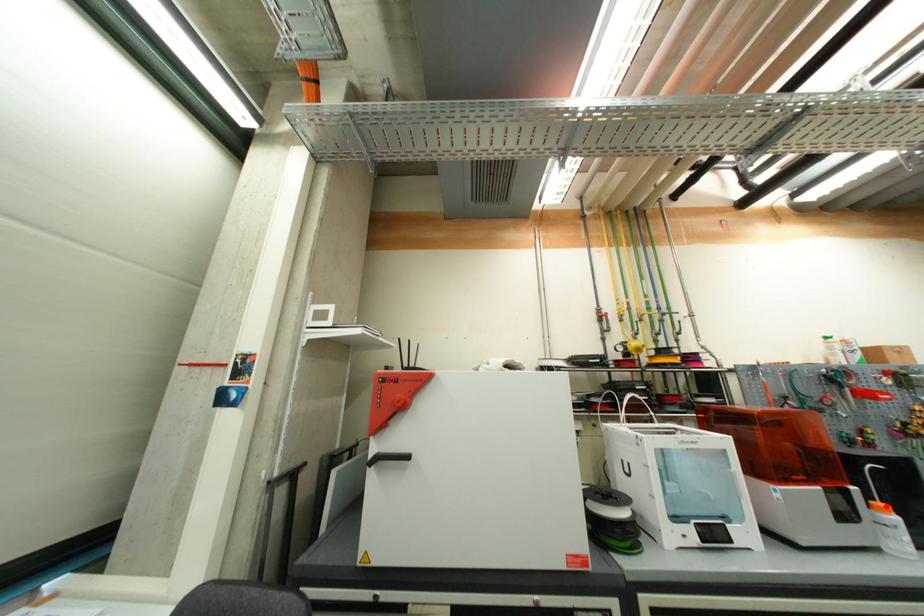
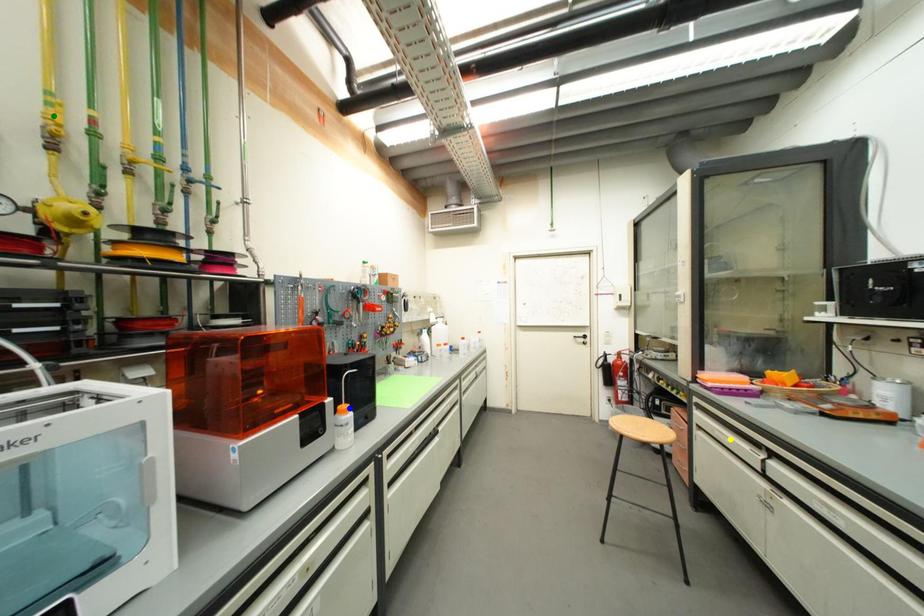
Question: I am providing you with two images of the same scene from different viewpoints. A red point is marked on the first image. You are given multiple points on the second image. Which mark in image 2 goes with the point in image 1?

Choices:
 (A) blue point
 (B) green point
 (C) yellow point

Answer: (A)